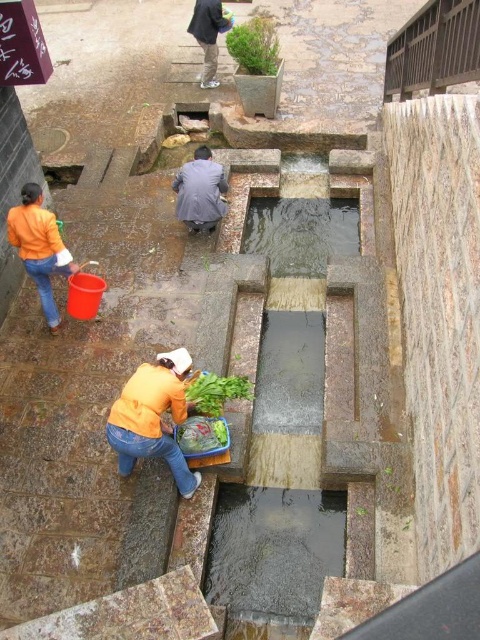
Question: Does clear water at center lie in front of green leafy vegetables at center?

Choices:
 (A) yes
 (B) no

Answer: (B)

Question: Which of the following is the closest to the observer?

Choices:
 (A) (186, 179)
 (B) (252, 547)

Answer: (B)

Question: Which of the following is the farthest from the observer?

Choices:
 (A) (214, 42)
 (B) (230, 376)
 (C) (317, 232)

Answer: (A)

Question: Is clear water at center further to camera compared to green leafy vegetables at center?

Choices:
 (A) yes
 (B) no

Answer: (A)

Question: Can you confirm if orange matte shirt at lower center is smaller than green leafy vegetables at center?

Choices:
 (A) no
 (B) yes

Answer: (A)

Question: Which of these objects is positioned farthest from the dark gray pants at upper center?

Choices:
 (A) orange matte shirt at lower center
 (B) green leafy vegetable at center
 (C) clear concrete water at center

Answer: (C)